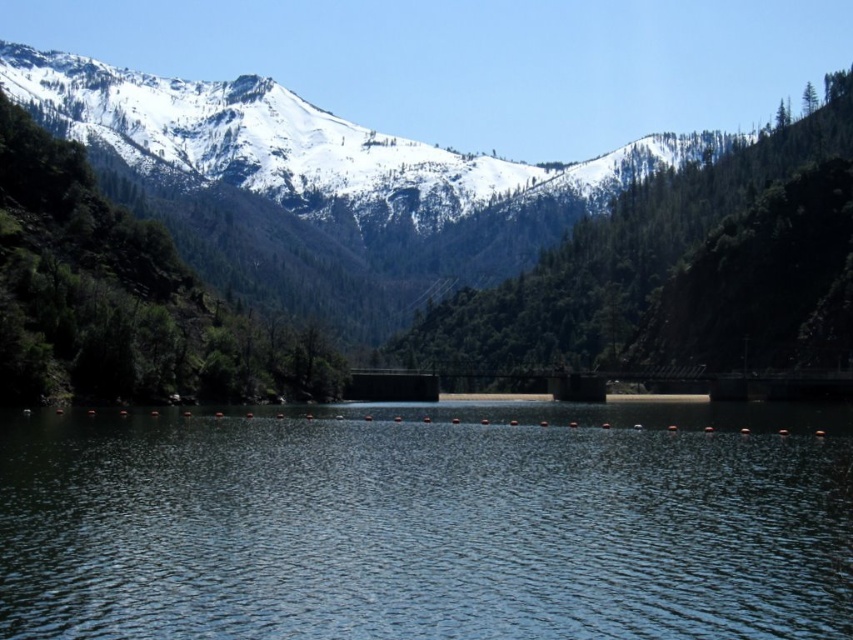
Question: Does clear blue water at center have a lesser width compared to green textured tree at upper center?

Choices:
 (A) yes
 (B) no

Answer: (B)

Question: Among these objects, which one is nearest to the camera?

Choices:
 (A) clear blue water at center
 (B) green textured tree at upper center

Answer: (A)

Question: From the image, what is the correct spatial relationship of clear blue water at center in relation to green textured tree at upper center?

Choices:
 (A) left
 (B) right

Answer: (A)

Question: Can you confirm if clear blue water at center is wider than green textured tree at upper center?

Choices:
 (A) yes
 (B) no

Answer: (A)

Question: Which object appears farthest from the camera in this image?

Choices:
 (A) green textured tree at upper center
 (B) clear blue water at center

Answer: (A)